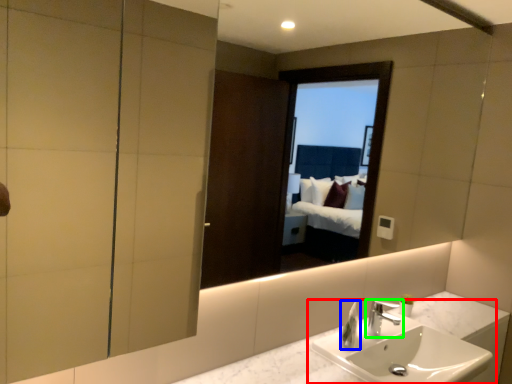
Question: Estimate the real-world distances between objects in this image. Which object is farther from sink (highlighted by a red box), soap dispenser (highlighted by a blue box) or tap (highlighted by a green box)?

Choices:
 (A) soap dispenser
 (B) tap

Answer: (A)